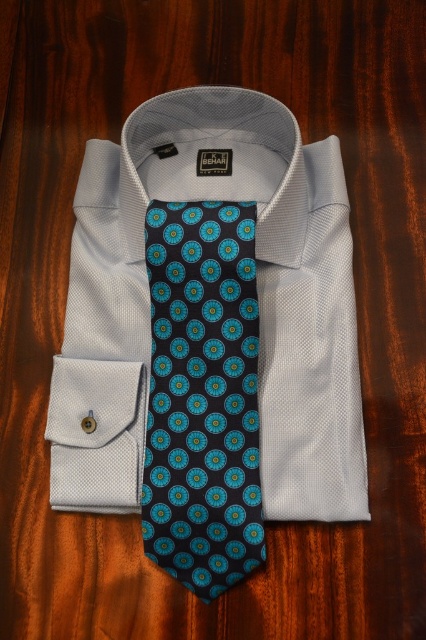
Question: Can you confirm if white textured dress shirt at center is positioned to the left of dark blue silk tie at center?

Choices:
 (A) yes
 (B) no

Answer: (B)

Question: Can you confirm if white textured dress shirt at center is positioned below dark blue silk tie at center?

Choices:
 (A) yes
 (B) no

Answer: (B)

Question: In this image, where is white textured dress shirt at center located relative to dark blue silk tie at center?

Choices:
 (A) right
 (B) left

Answer: (A)

Question: Which point is closer to the camera taking this photo?

Choices:
 (A) (192, 442)
 (B) (85, 385)

Answer: (A)

Question: Which of the following is the closest to the observer?

Choices:
 (A) (302, 268)
 (B) (178, 492)

Answer: (B)